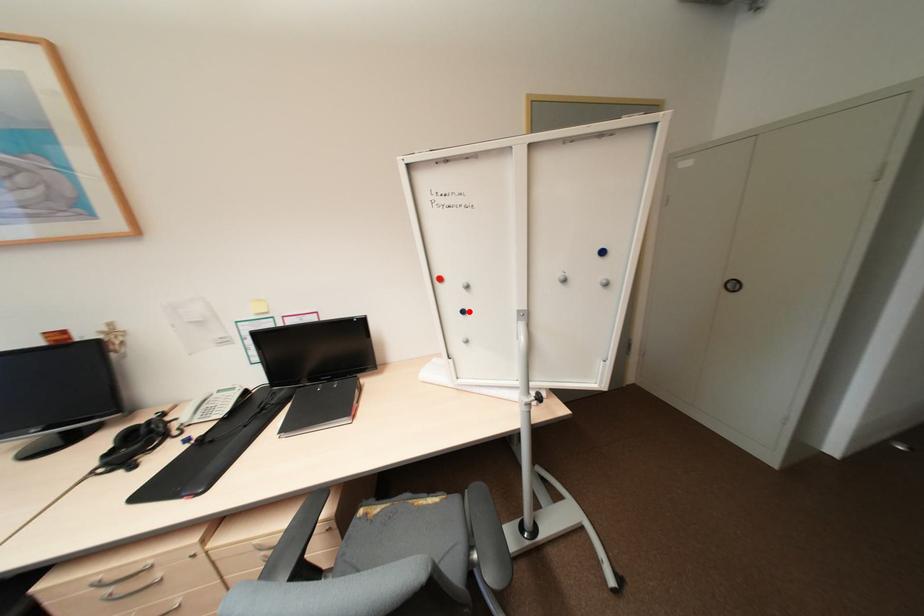
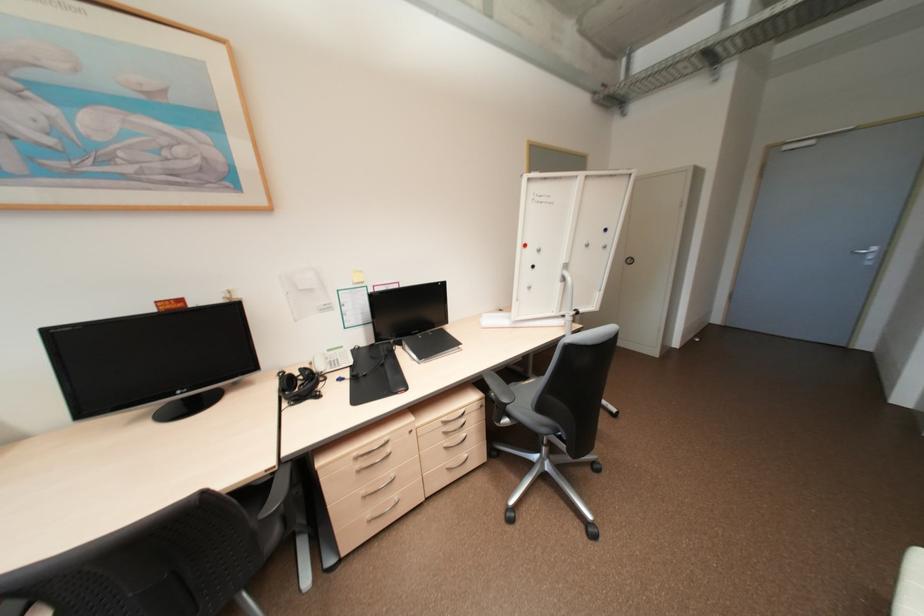
Locate, in the second image, the point that corresponds to the highlighted location in the first image.

(539, 265)